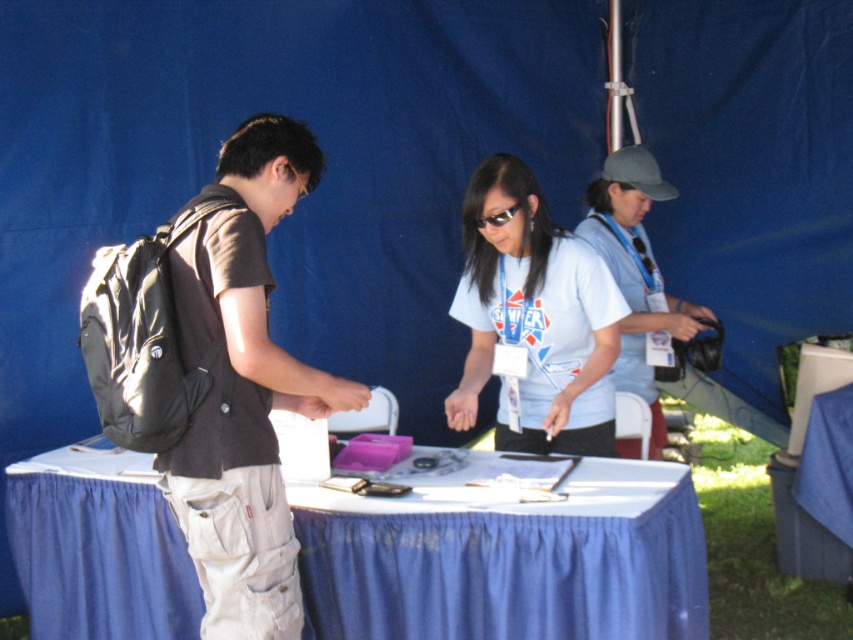
Question: Does blue fabric table at center have a lesser width compared to black plastic goggles at center?

Choices:
 (A) yes
 (B) no

Answer: (B)

Question: Considering the real-world distances, which object is closest to the white matte shirt at center?

Choices:
 (A) gray fabric cap at upper center
 (B) dark gray backpack at center
 (C) black plastic goggles at center
 (D) blue fabric table at center

Answer: (C)

Question: Considering the real-world distances, which object is closest to the black plastic goggles at center?

Choices:
 (A) dark gray backpack at center
 (B) blue fabric table at center
 (C) white matte shirt at center

Answer: (C)

Question: Which is farther from the gray fabric cap at upper center?

Choices:
 (A) black plastic goggles at center
 (B) blue fabric table at center

Answer: (A)

Question: Is dark gray backpack at center above white matte shirt at center?

Choices:
 (A) yes
 (B) no

Answer: (B)

Question: Can you confirm if blue fabric table at center is positioned to the left of black plastic goggles at center?

Choices:
 (A) yes
 (B) no

Answer: (B)